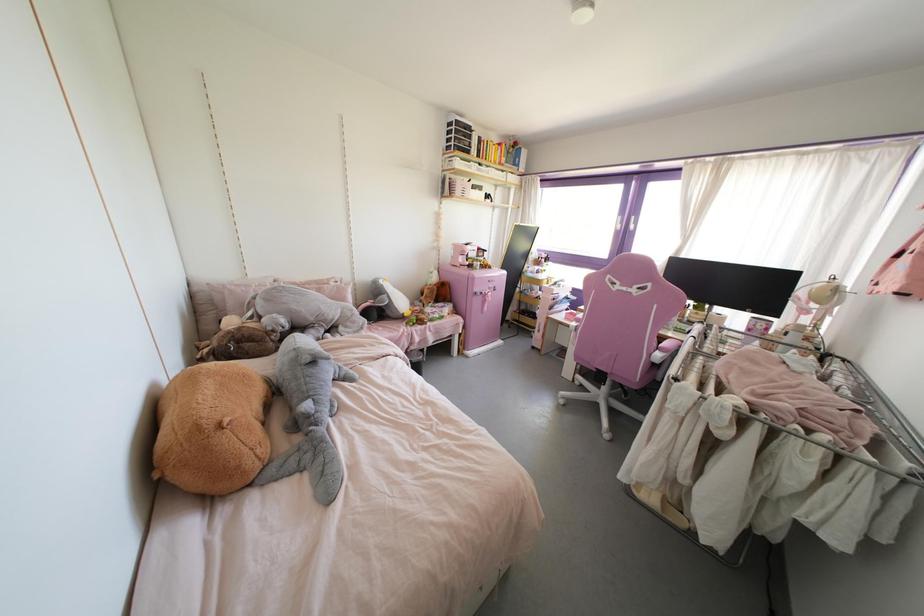
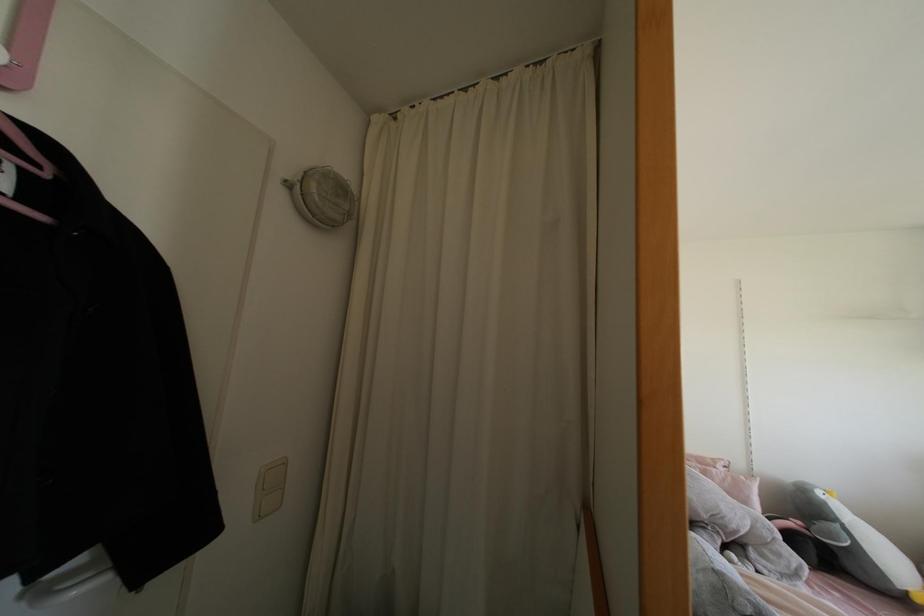
Locate, in the second image, the point that corresponds to point (381, 281) in the first image.

(819, 493)